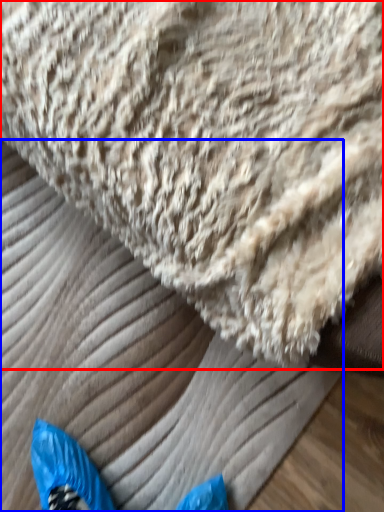
Question: Which object is further to the camera taking this photo, towel (highlighted by a red box) or sheet (highlighted by a blue box)?

Choices:
 (A) towel
 (B) sheet

Answer: (B)